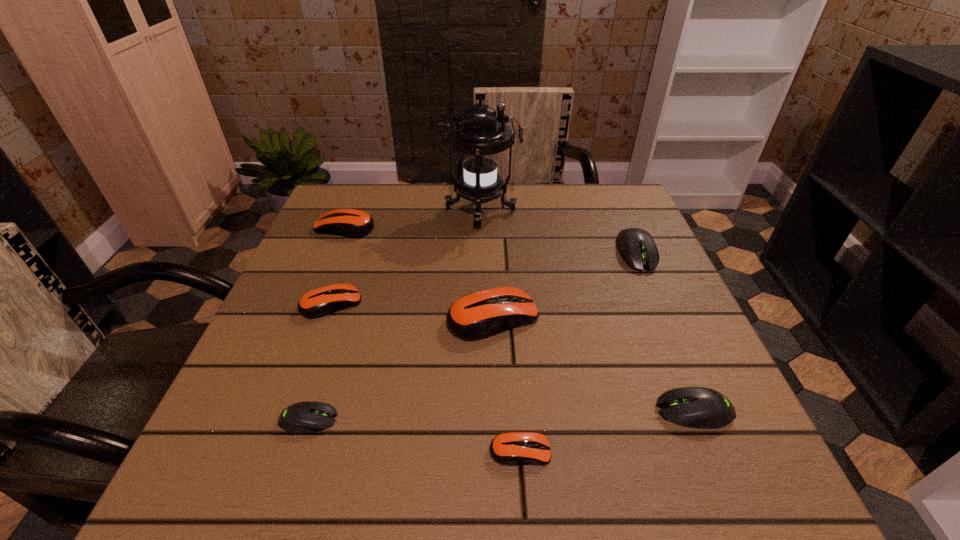
This screenshot has height=540, width=960. I want to click on vacant area that lies between the farthest orange computer mouse and the smallest gray computer mouse, so click(327, 323).

Find the location of `object that can be found as the seventh closest to the black lantern`. object that can be found as the seventh closest to the black lantern is located at coordinates coord(512,448).

Identify which object is the seventh nearest to the third smallest orange computer mouse. Please provide its 2D coordinates. Your answer should be formatted as a tuple, i.e. [(x, y)], where the tuple contains the x and y coordinates of a point satisfying the conditions above.

[(695, 407)]

Select which computer mouse appears as the sixth closest to the second smallest gray computer mouse. Please provide its 2D coordinates. Your answer should be formatted as a tuple, i.e. [(x, y)], where the tuple contains the x and y coordinates of a point satisfying the conditions above.

[(353, 223)]

Where is `the closest computer mouse to the farthest gray computer mouse`? the closest computer mouse to the farthest gray computer mouse is located at coordinates (479, 315).

In order to click on the third closest orange computer mouse to the biggest orange computer mouse in this screenshot , I will do `click(353, 223)`.

Identify the location of orange computer mouse object that ranks as the fourth closest to the second smallest gray computer mouse. The width and height of the screenshot is (960, 540). 353,223.

Identify which gray computer mouse is the second closest to the second biggest gray computer mouse. Please provide its 2D coordinates. Your answer should be formatted as a tuple, i.e. [(x, y)], where the tuple contains the x and y coordinates of a point satisfying the conditions above.

[(303, 417)]

Find the location of `the third closest gray computer mouse relative to the nearest orange computer mouse`. the third closest gray computer mouse relative to the nearest orange computer mouse is located at coordinates (637, 248).

Find the location of a particular element. The image size is (960, 540). free location that satisfies the following two spatial constraints: 1. on the front side of the tallest object; 2. on the wheel side of the leftmost gray computer mouse is located at coordinates (480, 420).